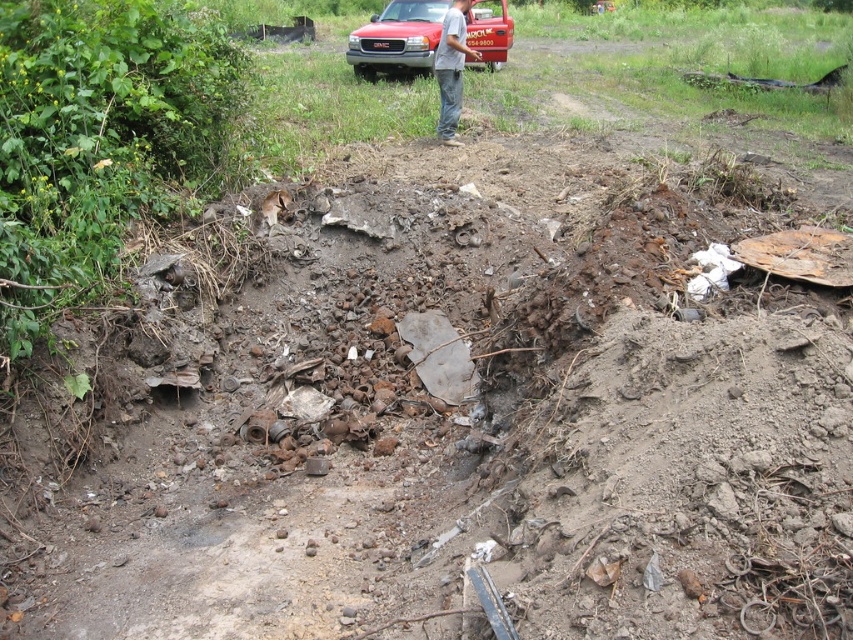
How much distance is there between matte red truck at upper center and gray jeans at center?

matte red truck at upper center is 4.47 meters away from gray jeans at center.

Is matte red truck at upper center bigger than gray jeans at center?

No.

Measure the distance between matte red truck at upper center and camera.

matte red truck at upper center is 39.64 feet away from camera.

Image resolution: width=853 pixels, height=640 pixels. What are the coordinates of `matte red truck at upper center` in the screenshot? It's located at (397, 38).